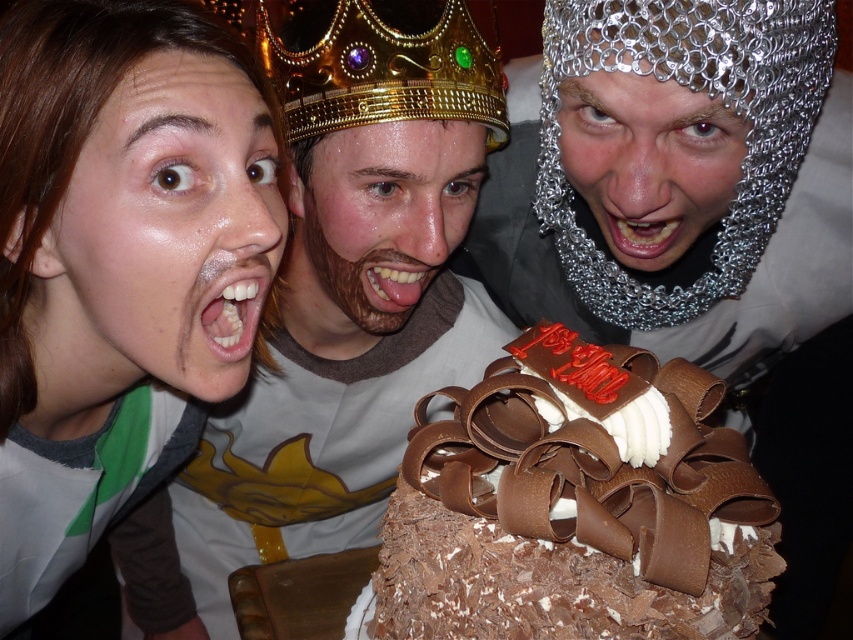
You are a photographer adjusting the camera settings for a group photo. The camera has a focus range of 20 centimeters. Given the distance between the satin skin face at upper left and the gold metallic crown at center, will the camera be able to focus on both subjects simultaneously?

The distance between the satin skin face at upper left and the gold metallic crown at center is 23.47 centimeters, which exceeds the camera focus range of 20 centimeters. Therefore, the camera cannot focus on both subjects simultaneously.

You are standing in front of the group of three people around the chocolate cake. There are two points marked in the image. The first point is at coordinates point (x=54, y=397) and the second point is at point (x=312, y=300). Which point is closer to you?

Point (x=54, y=397) is in front of point (x=312, y=300), so it is closer to you.

You are at a birthday party and see a photo with a satin skin face at upper left and a gold metallic crown at center. Which object is located more to the left side in the photo?

The satin skin face at upper left is positioned on the left side of the gold metallic crown at center, so it is more to the left side in the photo.